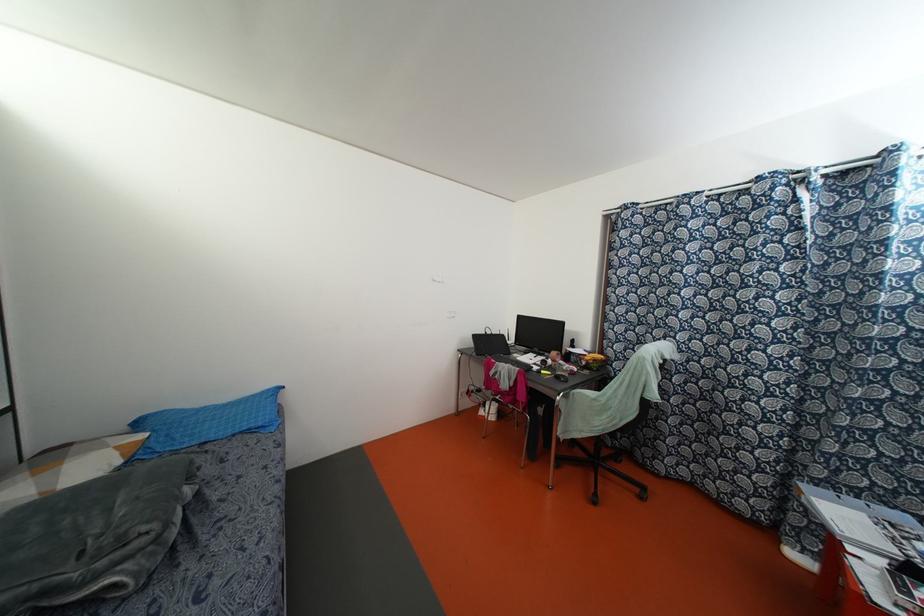
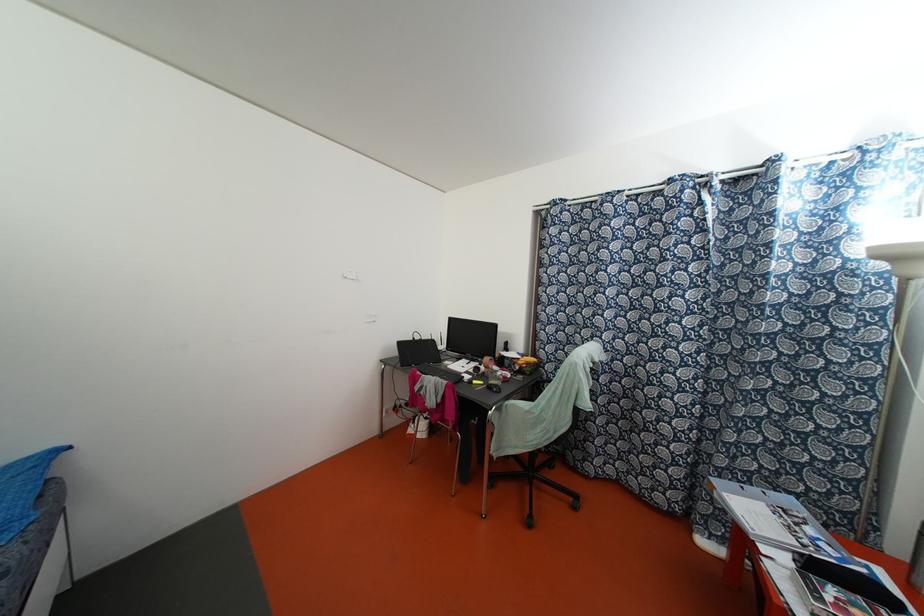
The images are taken continuously from a first-person perspective. In which direction are you moving?

The cameraman moved toward right, forward.